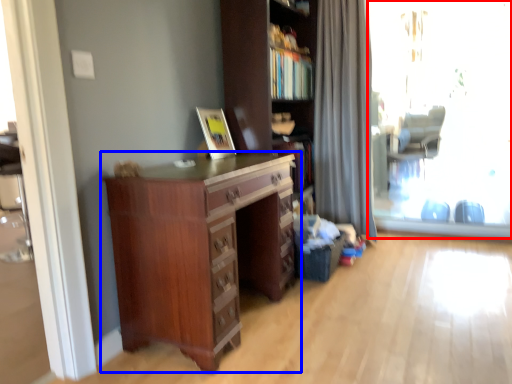
Question: Which object appears closest to the camera in this image, window screen (highlighted by a red box) or chest of drawers (highlighted by a blue box)?

Choices:
 (A) window screen
 (B) chest of drawers

Answer: (B)